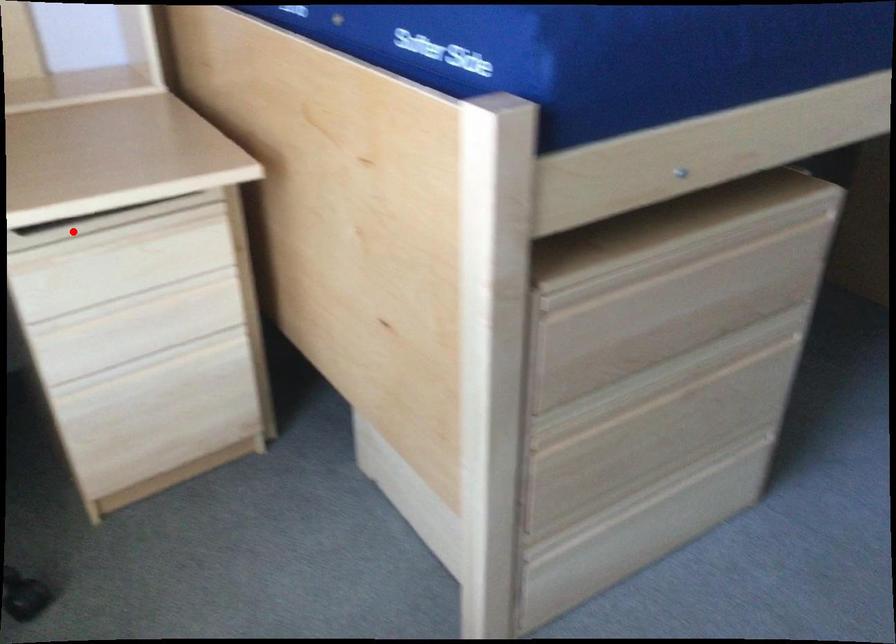
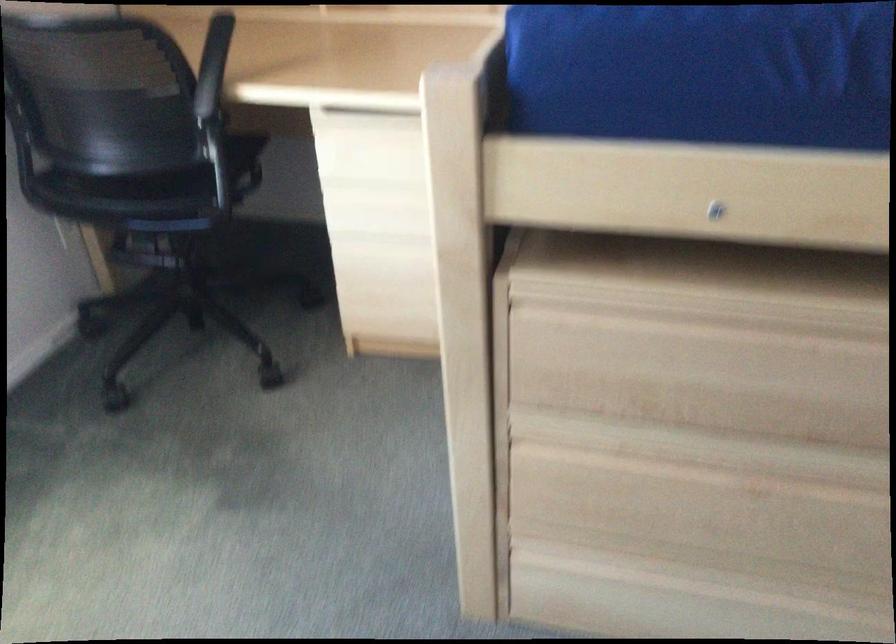
Question: A red point is marked in image1. In image2, is the corresponding 3D point closer to the camera or farther? Reply with the corresponding letter.

Choices:
 (A) The corresponding 3D point is closer.
 (B) The corresponding 3D point is farther.

Answer: (B)